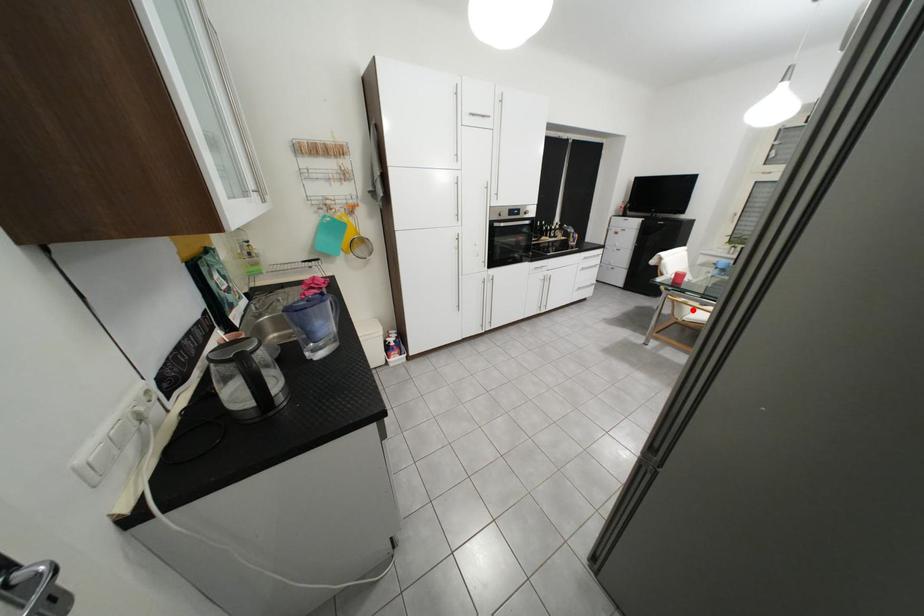
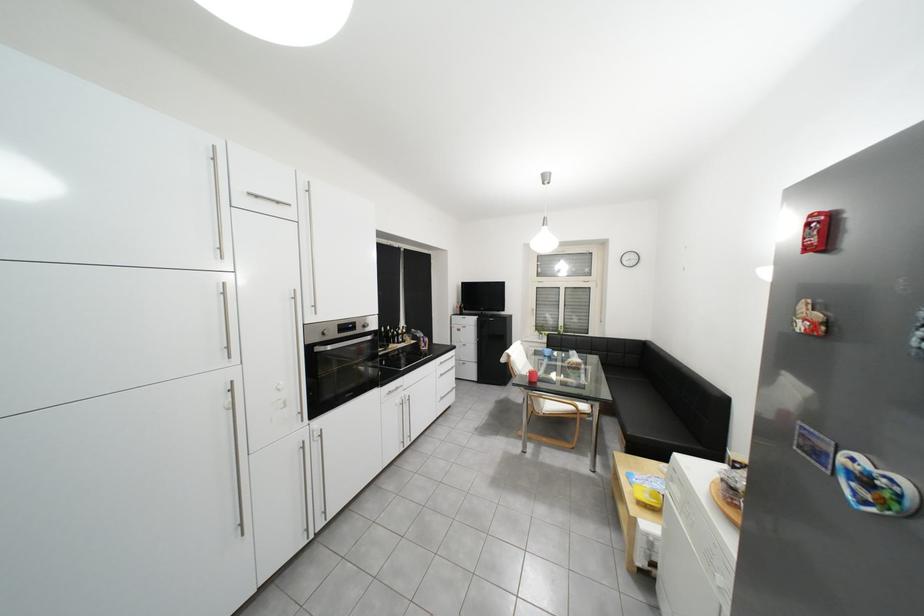
Where in the second image is the point corresponding to the highlighted location from the first image?

(551, 403)